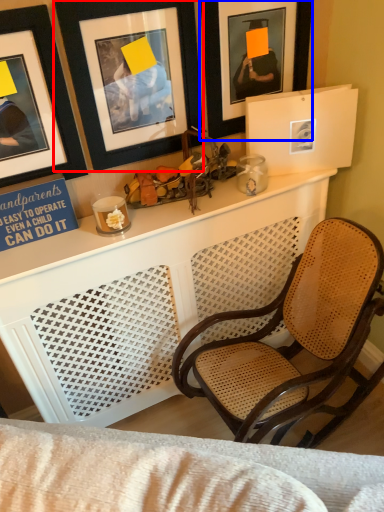
Question: Among these objects, which one is farthest to the camera, picture frame (highlighted by a red box) or picture frame (highlighted by a blue box)?

Choices:
 (A) picture frame
 (B) picture frame

Answer: (B)